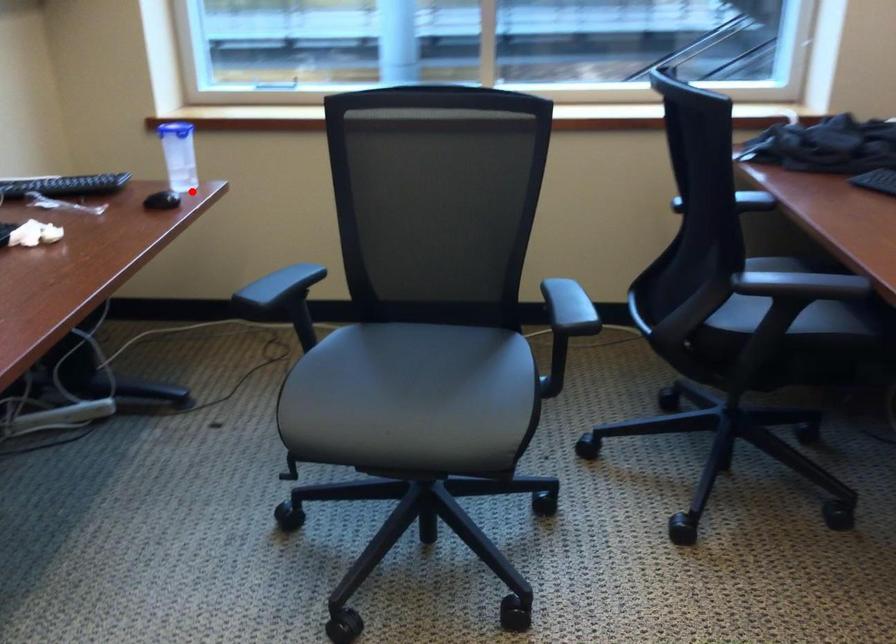
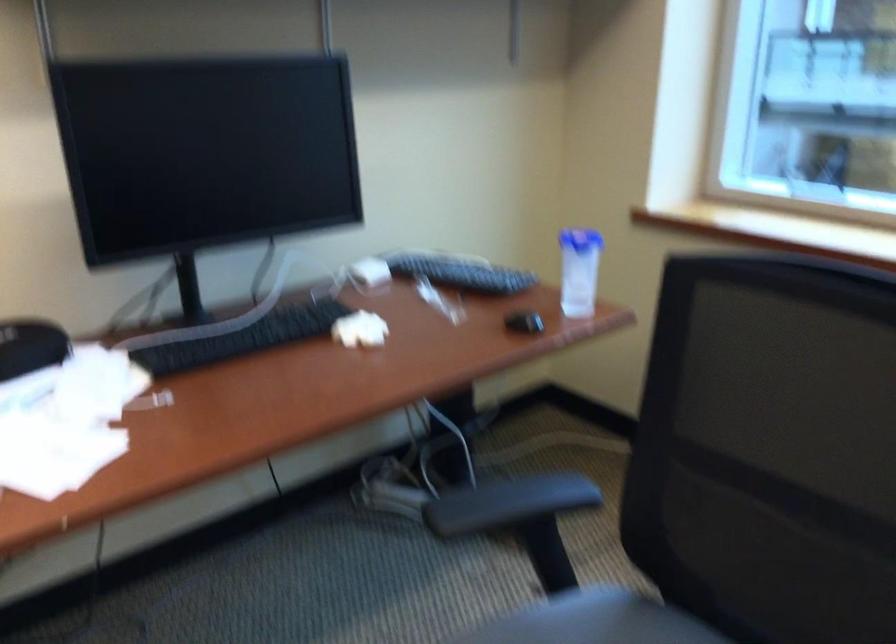
The point at the highlighted location is marked in the first image. Where is the corresponding point in the second image?

(523, 322)